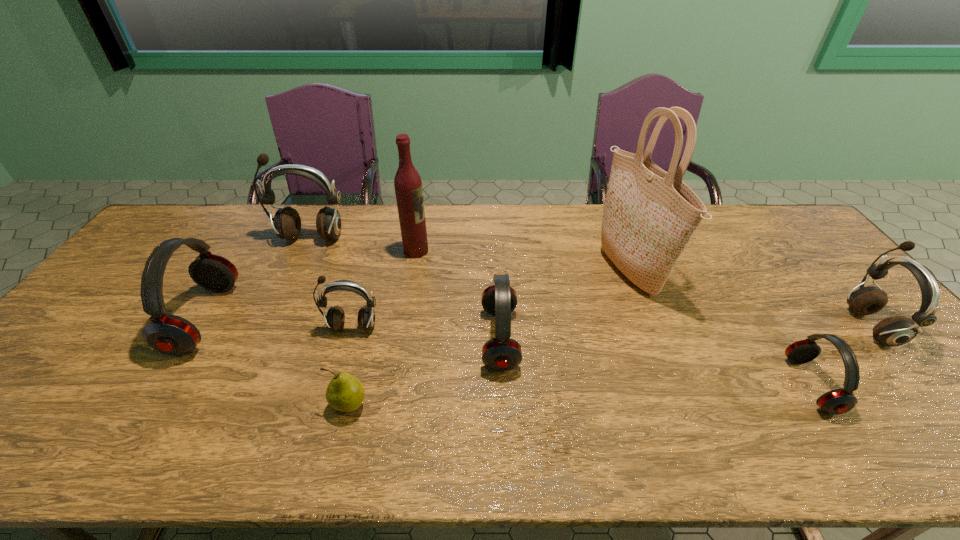
Where is `vacant point located between the biggest red earphone and the second red earphone from left to right`? This screenshot has width=960, height=540. vacant point located between the biggest red earphone and the second red earphone from left to right is located at coordinates (352, 329).

Identify the location of free space between the farthest brown earphone and the third earphone from left to right. (331, 282).

In order to click on empty space that is in between the third tallest object and the fourth object from right to left in this screenshot , I will do `click(405, 288)`.

Where is `free area in between the leftmost red earphone and the sixth object from left to right`? Image resolution: width=960 pixels, height=540 pixels. free area in between the leftmost red earphone and the sixth object from left to right is located at coordinates (352, 329).

Where is `free space between the rightmost red earphone and the farthest brown earphone`? Image resolution: width=960 pixels, height=540 pixels. free space between the rightmost red earphone and the farthest brown earphone is located at coordinates (561, 311).

At what (x,y) coordinates should I click in order to perform the action: click on vacant region between the smallest brown earphone and the leftmost red earphone. Please return your answer as a coordinate pair (x, y). This screenshot has width=960, height=540. Looking at the image, I should click on (278, 322).

At what (x,y) coordinates should I click in order to perform the action: click on empty space between the pear and the third object from right to left. Please return your answer as a coordinate pair (x, y). The image size is (960, 540). Looking at the image, I should click on (489, 339).

The width and height of the screenshot is (960, 540). What are the coordinates of `vacant space that is in between the shortest object and the leftmost red earphone` in the screenshot? It's located at (276, 362).

Find the location of a particular element. This screenshot has width=960, height=540. vacant point located between the fifth object from right to left and the seventh object from left to right is located at coordinates (522, 261).

At what (x,y) coordinates should I click in order to perform the action: click on object identified as the closest to the fourth earphone from right to left. Please return your answer as a coordinate pair (x, y). Looking at the image, I should click on (345, 393).